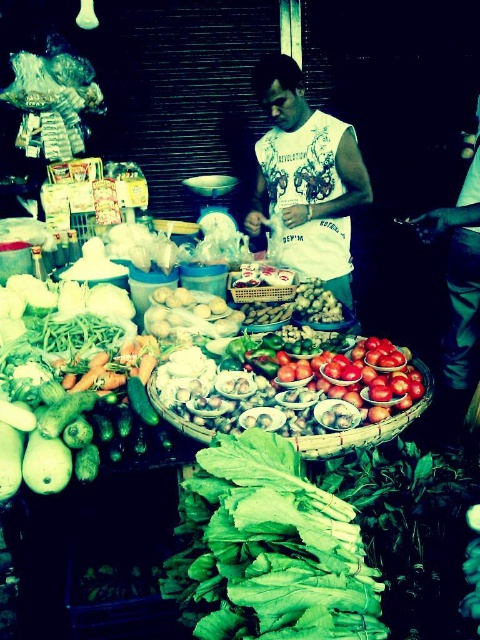
Question: Which point is closer to the camera?

Choices:
 (A) wooden woven basket at center
 (B) white printed t-shirt at center
 (C) green leafy at center

Answer: (C)

Question: Which object is farther from the camera taking this photo?

Choices:
 (A) green leafy at center
 (B) wooden woven basket at center

Answer: (B)

Question: Can you confirm if white printed t-shirt at center is thinner than wooden woven basket at center?

Choices:
 (A) yes
 (B) no

Answer: (B)

Question: Which object appears closest to the camera in this image?

Choices:
 (A) green leafy at center
 (B) wooden woven basket at center

Answer: (A)

Question: Can you confirm if white printed t-shirt at center is positioned to the left of wooden woven basket at center?

Choices:
 (A) no
 (B) yes

Answer: (A)

Question: In this image, where is green leafy at center located relative to white printed t-shirt at center?

Choices:
 (A) below
 (B) above

Answer: (A)